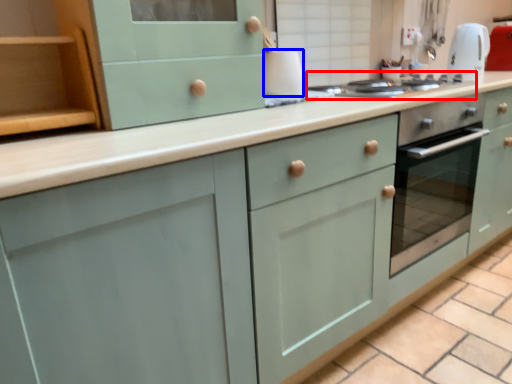
Question: Which of the following is the farthest to the observer, home appliance (highlighted by a red box) or appliance (highlighted by a blue box)?

Choices:
 (A) home appliance
 (B) appliance

Answer: (B)